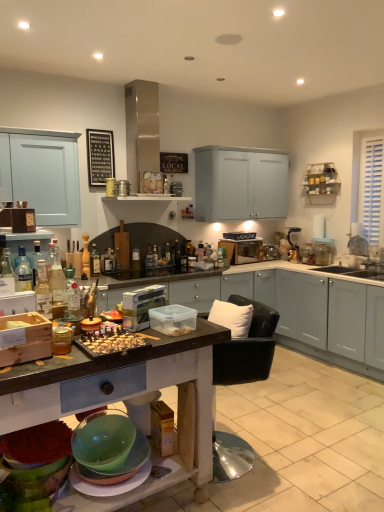
Question: Is translucent glass bottle at left, which ranks as the fourth bottle in right-to-left order, closer to the viewer compared to wooden signboard at upper left?

Choices:
 (A) no
 (B) yes

Answer: (B)

Question: From the image's perspective, is translucent glass bottle at left, the third bottle when ordered from left to right, located above wooden signboard at upper left?

Choices:
 (A) no
 (B) yes

Answer: (A)

Question: Is translucent glass bottle at left, which ranks as the fourth bottle in right-to-left order, taller than wooden signboard at upper left?

Choices:
 (A) no
 (B) yes

Answer: (A)

Question: Does translucent glass bottle at left, acting as the 6th bottle starting from the back, have a lesser width compared to wooden signboard at upper left?

Choices:
 (A) no
 (B) yes

Answer: (A)

Question: Is translucent glass bottle at left, the third bottle when ordered from left to right, oriented towards wooden signboard at upper left?

Choices:
 (A) yes
 (B) no

Answer: (B)

Question: Is translucent glass bottle at left, which ranks as the fourth bottle in right-to-left order, outside of wooden signboard at upper left?

Choices:
 (A) no
 (B) yes

Answer: (B)

Question: Is translucent glass bottle at center, which ranks as the 4th bottle in front-to-back order, at the left side of translucent glass bottle at center, placed as the 1th bottle when sorted from back to front?

Choices:
 (A) no
 (B) yes

Answer: (B)

Question: Is translucent glass bottle at center, placed as the 3th bottle when sorted from back to front, shorter than translucent glass bottle at center, placed as the 1th bottle when sorted from back to front?

Choices:
 (A) no
 (B) yes

Answer: (A)

Question: Considering the relative sizes of translucent glass bottle at center, which ranks as the 4th bottle in front-to-back order, and translucent glass bottle at center, which appears as the 6th bottle when viewed from the front, in the image provided, is translucent glass bottle at center, which ranks as the 4th bottle in front-to-back order, thinner than translucent glass bottle at center, which appears as the 6th bottle when viewed from the front,?

Choices:
 (A) no
 (B) yes

Answer: (A)

Question: Is translucent glass bottle at center, arranged as the 6th bottle when viewed from the right, far away from translucent glass bottle at center, which appears as the 6th bottle when viewed from the front?

Choices:
 (A) no
 (B) yes

Answer: (A)

Question: From the image's perspective, is translucent glass bottle at center, marked as the first bottle in a left-to-right arrangement, on translucent glass bottle at center, placed as the 1th bottle when sorted from back to front?

Choices:
 (A) yes
 (B) no

Answer: (B)

Question: Is translucent glass bottle at center, which appears as the 6th bottle when viewed from the front, located within translucent glass bottle at center, placed as the 3th bottle when sorted from back to front?

Choices:
 (A) yes
 (B) no

Answer: (B)

Question: Is metallic silver blender at upper right, the 2th appliance in the top-to-bottom sequence, looking in the opposite direction of translucent glass bottle at center, placed as the 3th bottle when sorted from back to front?

Choices:
 (A) yes
 (B) no

Answer: (B)